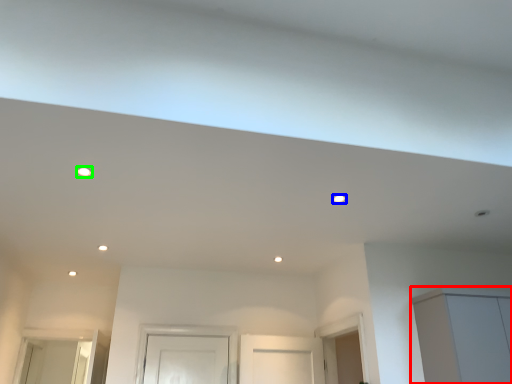
Question: Which object is positioned closest to cabinetry (highlighted by a red box)? Select from lighting (highlighted by a blue box) and lighting (highlighted by a green box).

Choices:
 (A) lighting
 (B) lighting

Answer: (A)